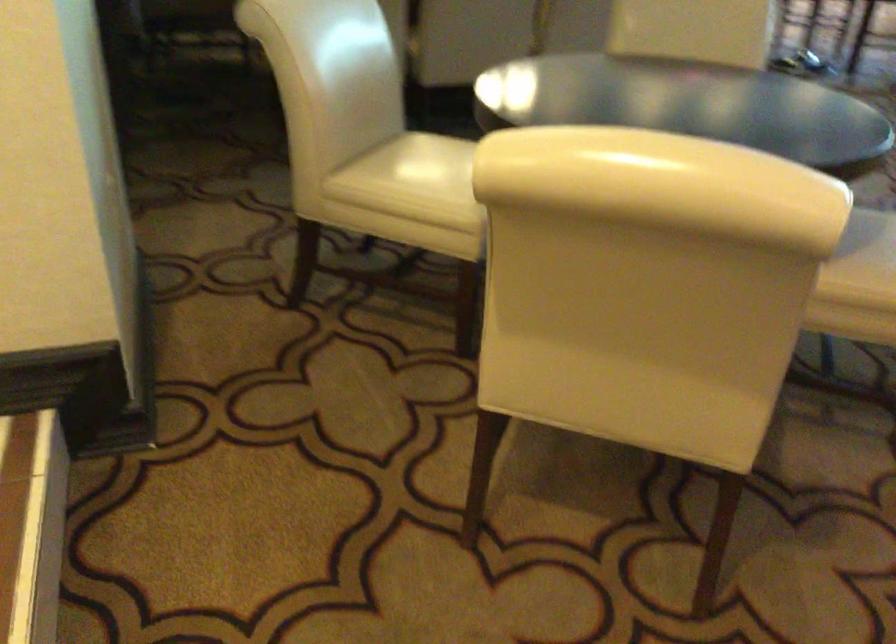
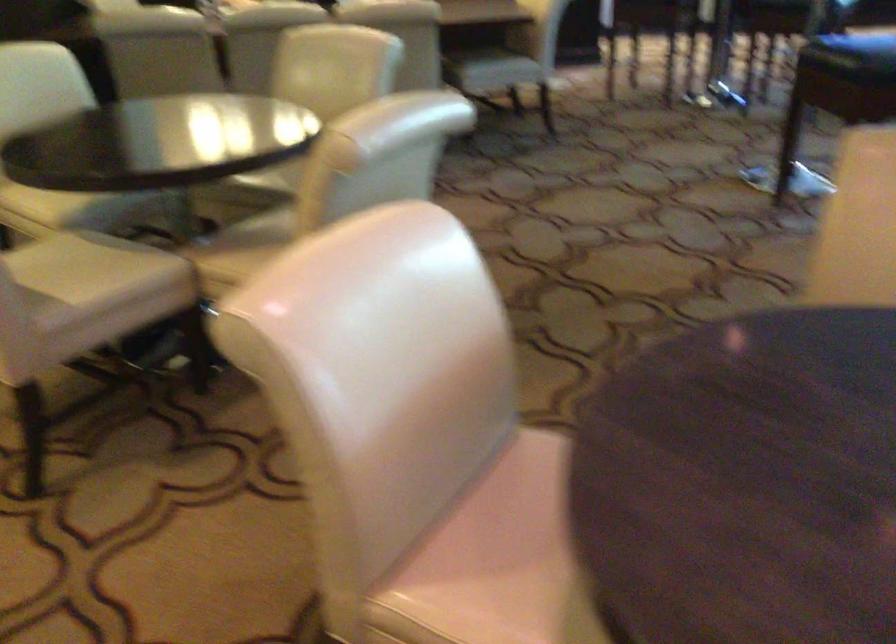
Question: What movement of the cameraman would produce the second image?

Choices:
 (A) Left
 (B) Right
 (C) Forward
 (D) Backward

Answer: (B)